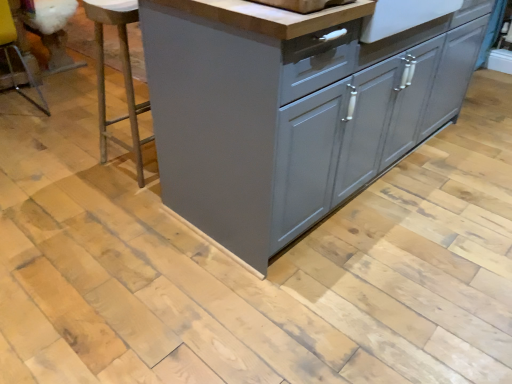
Question: Considering their positions, is metallic silver bar stool at left, which is counted as the first bar stool, starting from the right, located in front of or behind matte gray cabinet at center?

Choices:
 (A) behind
 (B) front

Answer: (A)

Question: Is point (104, 142) positioned closer to the camera than point (201, 124)?

Choices:
 (A) farther
 (B) closer

Answer: (A)

Question: Considering the real-world distances, which object is closest to the clear plastic bar stool at left, the first bar stool viewed from the left?

Choices:
 (A) matte gray cabinet at center
 (B) metallic silver bar stool at left, which is counted as the first bar stool, starting from the right

Answer: (B)

Question: Which of these objects is positioned farthest from the metallic silver bar stool at left, acting as the 2th bar stool starting from the left?

Choices:
 (A) matte gray cabinet at center
 (B) clear plastic bar stool at left, the second bar stool viewed from the right

Answer: (B)